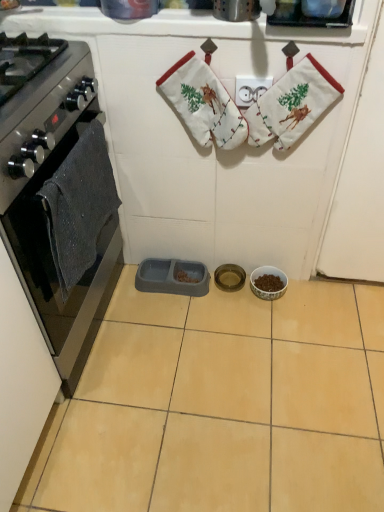
Locate an element on the screen. vacant region to the left of gray plastic pet feeder at center, which is the third appliance in right-to-left order is located at coordinates (124, 291).